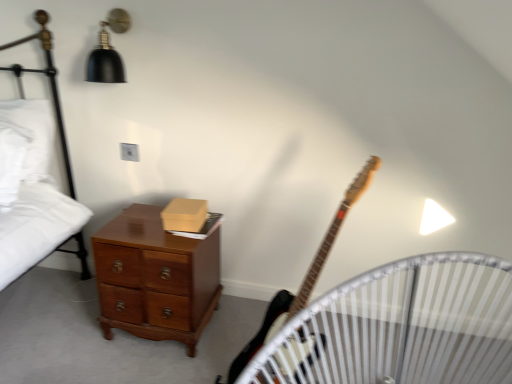
Question: Does white soft pillow at left lie behind wooden crib at lower left?

Choices:
 (A) no
 (B) yes

Answer: (B)

Question: Can you confirm if white soft pillow at left is wider than wooden crib at lower left?

Choices:
 (A) yes
 (B) no

Answer: (B)

Question: From the image's perspective, is white soft pillow at left below wooden crib at lower left?

Choices:
 (A) no
 (B) yes

Answer: (A)

Question: From a real-world perspective, is white soft pillow at left located higher than wooden crib at lower left?

Choices:
 (A) no
 (B) yes

Answer: (B)

Question: From the image's perspective, is white soft pillow at left on top of wooden crib at lower left?

Choices:
 (A) no
 (B) yes

Answer: (B)

Question: Is white soft pillow at left at the left side of wooden crib at lower left?

Choices:
 (A) yes
 (B) no

Answer: (A)

Question: Is wooden electric guitar at center-right positioned with its back to wooden crib at lower left?

Choices:
 (A) no
 (B) yes

Answer: (A)

Question: Can you confirm if wooden electric guitar at center-right is smaller than wooden crib at lower left?

Choices:
 (A) yes
 (B) no

Answer: (A)

Question: Considering the relative sizes of wooden electric guitar at center-right and wooden crib at lower left in the image provided, is wooden electric guitar at center-right thinner than wooden crib at lower left?

Choices:
 (A) no
 (B) yes

Answer: (B)

Question: From a real-world perspective, is wooden electric guitar at center-right beneath wooden crib at lower left?

Choices:
 (A) no
 (B) yes

Answer: (B)

Question: Is wooden electric guitar at center-right shorter than wooden crib at lower left?

Choices:
 (A) yes
 (B) no

Answer: (B)

Question: From the image's perspective, is wooden electric guitar at center-right below wooden crib at lower left?

Choices:
 (A) yes
 (B) no

Answer: (B)

Question: Can you confirm if wooden crib at lower left is positioned to the right of white soft pillow at left?

Choices:
 (A) yes
 (B) no

Answer: (A)